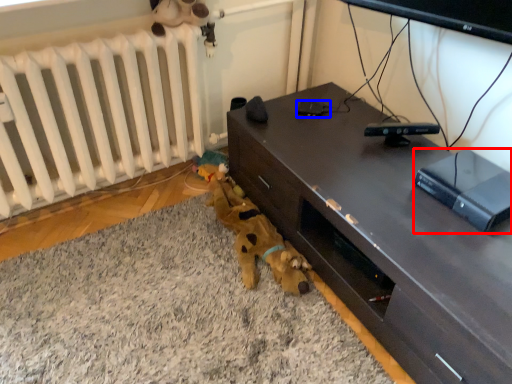
Question: Which object appears closest to the camera in this image, equipment (highlighted by a red box) or gadget (highlighted by a blue box)?

Choices:
 (A) equipment
 (B) gadget

Answer: (A)